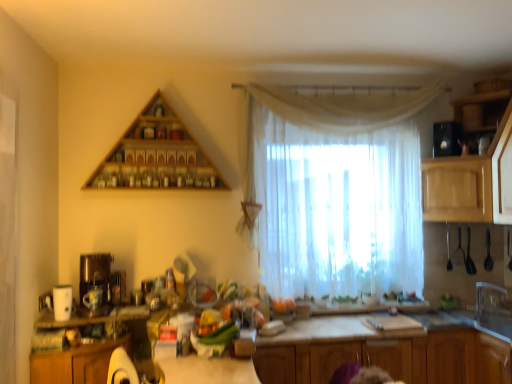
Question: From a real-world perspective, is matte brown coffee machine at left beneath wooden cabinets at center, acting as the second cabinetry starting from the left?

Choices:
 (A) yes
 (B) no

Answer: (B)

Question: From a real-world perspective, does matte brown coffee machine at left stand above wooden cabinets at center, acting as the second cabinetry starting from the left?

Choices:
 (A) yes
 (B) no

Answer: (A)

Question: Is matte brown coffee machine at left smaller than wooden cabinets at center, acting as the second cabinetry starting from the left?

Choices:
 (A) yes
 (B) no

Answer: (A)

Question: Could wooden cabinets at center, acting as the second cabinetry starting from the left, be considered to be inside matte brown coffee machine at left?

Choices:
 (A) yes
 (B) no

Answer: (B)

Question: Is matte brown coffee machine at left to the left of wooden cabinets at center, acting as the second cabinetry starting from the left, from the viewer's perspective?

Choices:
 (A) yes
 (B) no

Answer: (A)

Question: Does point (56, 296) appear closer or farther from the camera than point (89, 345)?

Choices:
 (A) closer
 (B) farther

Answer: (B)

Question: Considering the positions of white matte coffee maker at left, the 3th appliance viewed from the back, and wooden cabinet at lower left, the first cabinetry from the left, in the image, is white matte coffee maker at left, the 3th appliance viewed from the back, bigger or smaller than wooden cabinet at lower left, the first cabinetry from the left,?

Choices:
 (A) big
 (B) small

Answer: (B)

Question: From the image's perspective, relative to wooden cabinet at lower left, the first cabinetry from the left, is white matte coffee maker at left, the 3th appliance viewed from the top, above or below?

Choices:
 (A) below
 (B) above

Answer: (B)

Question: Do you think white matte coffee maker at left, the 3th appliance viewed from the back, is within wooden cabinet at lower left, the first cabinetry from the left, or outside of it?

Choices:
 (A) outside
 (B) inside

Answer: (A)

Question: Is matte brown coffee machine at left wider or thinner than clear plastic faucet at right?

Choices:
 (A) wide
 (B) thin

Answer: (A)

Question: Considering the relative positions of matte brown coffee machine at left and clear plastic faucet at right in the image provided, is matte brown coffee machine at left to the left or to the right of clear plastic faucet at right?

Choices:
 (A) right
 (B) left

Answer: (B)

Question: Considering their positions, is matte brown coffee machine at left located in front of or behind clear plastic faucet at right?

Choices:
 (A) front
 (B) behind

Answer: (A)

Question: Do you think matte brown coffee machine at left is within clear plastic faucet at right, or outside of it?

Choices:
 (A) outside
 (B) inside

Answer: (A)

Question: Considering the positions of black glossy microwave at upper right, which appears as the third appliance when viewed from the left, and clear plastic faucet at right in the image, is black glossy microwave at upper right, which appears as the third appliance when viewed from the left, taller or shorter than clear plastic faucet at right?

Choices:
 (A) short
 (B) tall

Answer: (A)

Question: Based on their sizes in the image, would you say black glossy microwave at upper right, acting as the 1th appliance starting from the right, is bigger or smaller than clear plastic faucet at right?

Choices:
 (A) big
 (B) small

Answer: (A)